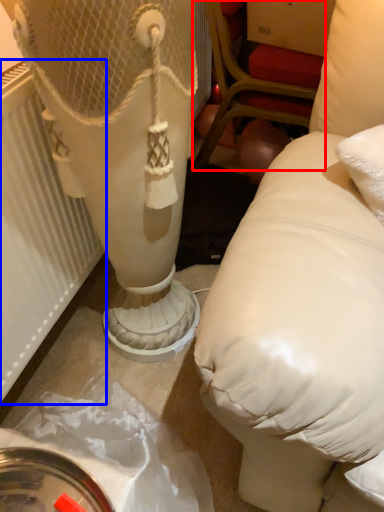
Question: Which object appears farthest to the camera in this image, furniture (highlighted by a red box) or radiator (highlighted by a blue box)?

Choices:
 (A) furniture
 (B) radiator

Answer: (A)